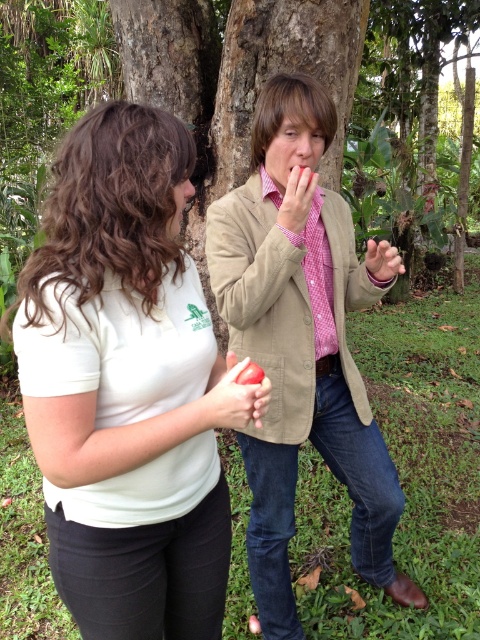
You are a photographer standing in front of the two people in the image. You want to take a photo that includes both the matte red apple at center and the matte pink shirt at upper center. Which object should you position closer to the left side of the frame?

The matte red apple at center should be positioned closer to the left side of the frame since it is already to the left of the matte pink shirt at upper center.

You are standing in a park and see two people. The first person is a woman wearing a light beige short sleeve polo shirt with a logo on the left chest area, holding a red object that might be a tomato. The second person is a man in a light beige blazer over a pink checkered shirt, wearing dark blue jeans and brown shoes. There is a point marked at coordinates (123, 385). Which person is wearing the white matte shirt at center represented by the point?

The white matte shirt at center represented by point (123, 385) is worn by the man in the light beige blazer over a pink checkered shirt.

You are a photographer trying to capture the perfect shot of the matte red apple at center. You want to position your camera exactly at the apple. What coordinates should you aim for?

The coordinates for the matte red apple at center are at point (232, 396).